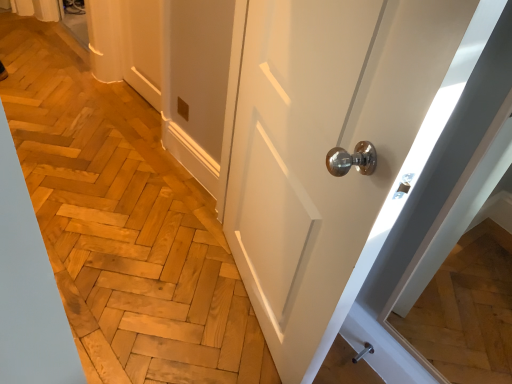
The width and height of the screenshot is (512, 384). Describe the element at coordinates (362, 352) in the screenshot. I see `polished metallic door handle at lower right` at that location.

Locate an element on the screen. polished metallic door handle at lower right is located at coordinates (362, 352).

Describe the element at coordinates (327, 151) in the screenshot. The height and width of the screenshot is (384, 512). I see `white glossy door at center` at that location.

In the scene shown: In order to face white glossy door at center, should I rotate leftwards or rightwards?

To align with it, rotate right about 2.639°.

I want to click on white glossy door at center, so click(327, 151).

What is the approximate height of white glossy door at center?

white glossy door at center is 1.08 meters in height.

Locate an element on the screen. The height and width of the screenshot is (384, 512). polished metallic door handle at lower right is located at coordinates (362, 352).

Considering the relative positions of polished metallic door handle at lower right and white glossy door at center in the image provided, is polished metallic door handle at lower right to the right of white glossy door at center from the viewer's perspective?

Yes, polished metallic door handle at lower right is to the right of white glossy door at center.

Which object is more forward, polished metallic door handle at lower right or white glossy door at center?

white glossy door at center is in front.

Does point (366, 353) lie in front of point (313, 307)?

No, (366, 353) is behind (313, 307).

From the image's perspective, is polished metallic door handle at lower right on top of white glossy door at center?

No, from the image's perspective, polished metallic door handle at lower right is not over white glossy door at center.

From a real-world perspective, is polished metallic door handle at lower right under white glossy door at center?

Yes, from a real-world perspective, polished metallic door handle at lower right is under white glossy door at center.

Can you confirm if polished metallic door handle at lower right is wider than white glossy door at center?

No, polished metallic door handle at lower right is not wider than white glossy door at center.

Considering the sizes of objects polished metallic door handle at lower right and white glossy door at center in the image provided, who is shorter, polished metallic door handle at lower right or white glossy door at center?

polished metallic door handle at lower right.

Which of these two, polished metallic door handle at lower right or white glossy door at center, is bigger?

white glossy door at center is bigger.

Would you say polished metallic door handle at lower right is outside white glossy door at center?

Yes, polished metallic door handle at lower right is located beyond the bounds of white glossy door at center.

Can you see polished metallic door handle at lower right touching white glossy door at center?

No, polished metallic door handle at lower right is not making contact with white glossy door at center.

Is polished metallic door handle at lower right turned away from white glossy door at center?

polished metallic door handle at lower right is not turned away from white glossy door at center.

How different are the orientations of polished metallic door handle at lower right and white glossy door at center in degrees?

22.2 degrees separate the facing orientations of polished metallic door handle at lower right and white glossy door at center.

How much distance is there between polished metallic door handle at lower right and white glossy door at center?

polished metallic door handle at lower right is 28.64 inches from white glossy door at center.

In order to click on door handle below the white glossy door at center (from a real-world perspective) in this screenshot , I will do `click(362, 352)`.

Considering the relative positions of white glossy door at center and polished metallic door handle at lower right in the image provided, is white glossy door at center to the right of polished metallic door handle at lower right from the viewer's perspective?

No.

Which object is more forward, white glossy door at center or polished metallic door handle at lower right?

white glossy door at center is closer to the camera.

Is point (306, 247) closer or farther from the camera than point (360, 354)?

Clearly, point (306, 247) is closer to the camera than point (360, 354).

From the image's perspective, which object appears higher, white glossy door at center or polished metallic door handle at lower right?

white glossy door at center is shown above in the image.

From a real-world perspective, which is physically below, white glossy door at center or polished metallic door handle at lower right?

In real-world perspective, polished metallic door handle at lower right is lower.

In terms of width, does white glossy door at center look wider or thinner when compared to polished metallic door handle at lower right?

white glossy door at center is wider than polished metallic door handle at lower right.

In terms of height, does white glossy door at center look taller or shorter compared to polished metallic door handle at lower right?

Clearly, white glossy door at center is taller compared to polished metallic door handle at lower right.

Looking at this image, who is smaller, white glossy door at center or polished metallic door handle at lower right?

With smaller size is polished metallic door handle at lower right.

Is polished metallic door handle at lower right surrounded by white glossy door at center?

Definitely not — polished metallic door handle at lower right is not inside white glossy door at center.

Is white glossy door at center directly adjacent to polished metallic door handle at lower right?

They are not placed beside each other.

Is white glossy door at center looking in the opposite direction of polished metallic door handle at lower right?

Yes, white glossy door at center is positioned with its back facing polished metallic door handle at lower right.

What are the coordinates of `door handle that is behind the white glossy door at center` in the screenshot? It's located at (362, 352).

The image size is (512, 384). There is a polished metallic door handle at lower right. Find the location of `door above it (from a real-world perspective)`. door above it (from a real-world perspective) is located at coordinates (327, 151).

Locate an element on the screen. This screenshot has width=512, height=384. door above the polished metallic door handle at lower right (from the image's perspective) is located at coordinates (327, 151).